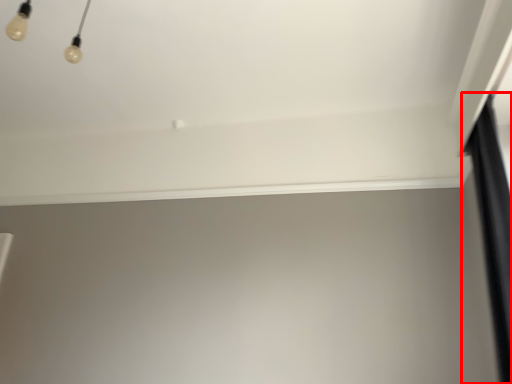
Question: From the image's perspective, what is the correct spatial relationship of curtain (annotated by the red box) in relation to window sill?

Choices:
 (A) above
 (B) below

Answer: (B)